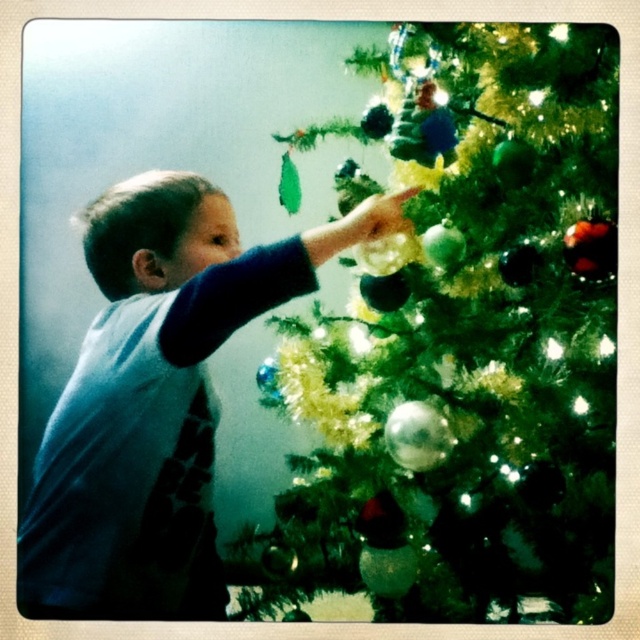
You are a photographer setting up for a family photo. You want to ensure the green matte christmas tree at upper right and the blue cotton shirt at upper left are both in focus. Based on the scene description, which object should be closer to the camera to achieve this?

The blue cotton shirt at upper left should be closer to the camera because the green matte christmas tree at upper right is positioned on the right side of it, meaning the tree is further away. To have both in focus, the shirt needs to be nearer so the depth of field can cover both distances.

You are a photographer trying to capture the green matte christmas tree at upper right and the blue cotton shirt at upper left in a single shot. Based on their positions, which object should you focus on first to ensure both are in focus?

The green matte christmas tree at upper right is located above the blue cotton shirt at upper left. To ensure both are in focus, you should focus on the blue cotton shirt at upper left first since it is closer to the camera, and then the tree will be in focus as it is further away but within the depth of field range.

You are a photographer adjusting your camera settings. You notice two points in the image labeled as point 1 and point 2. Point 1 is at coordinate [528,461] and point 2 is at coordinate [150,435]. Based on the scene description, which point is closer to the camera?

Point 1 at coordinate [528,461] is closer to the viewer than point 2 at coordinate [150,435].